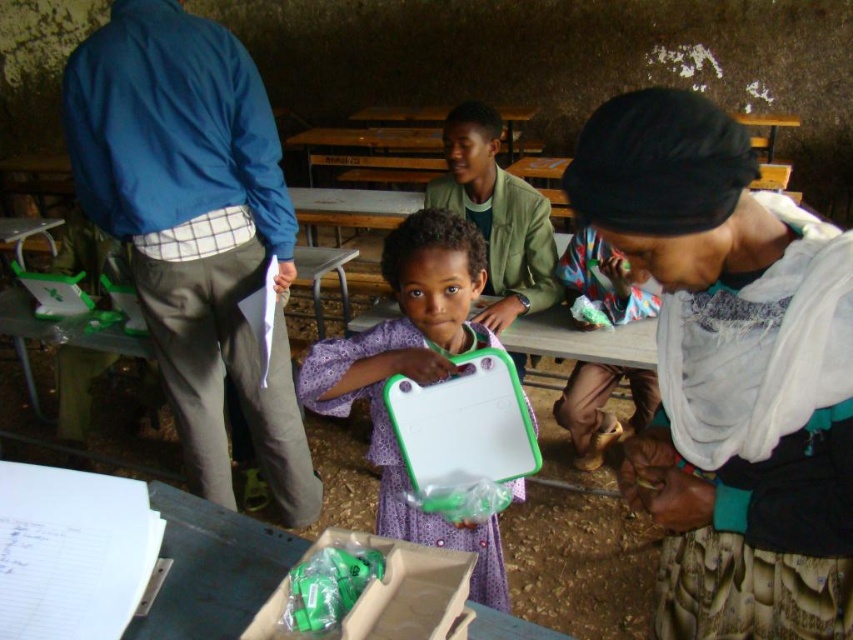
Is white cloth headscarf at upper right positioned behind purple fabric dress at center?

No, it is in front of purple fabric dress at center.

Does white cloth headscarf at upper right have a lesser height compared to purple fabric dress at center?

Correct, white cloth headscarf at upper right is not as tall as purple fabric dress at center.

Who is more distant from viewer, (717, 282) or (433, 310)?

The point (433, 310) is behind.

In order to click on white cloth headscarf at upper right in this screenshot , I will do `click(730, 371)`.

In the scene shown: Between blue fabric jacket at upper left and green plastic tray at center, which one appears on the left side from the viewer's perspective?

blue fabric jacket at upper left is more to the left.

Is point (270, 237) positioned in front of point (258, 598)?

That is False.

Locate an element on the screen. This screenshot has width=853, height=640. blue fabric jacket at upper left is located at coordinates (194, 227).

At what (x,y) coordinates should I click in order to perform the action: click on green plastic tray at center. Please return your answer as a coordinate pair (x, y). Looking at the image, I should click on (212, 570).

From the picture: Is green plastic tray at center to the right of multicolored fabric at lower right from the viewer's perspective?

In fact, green plastic tray at center is to the left of multicolored fabric at lower right.

Does point (212, 605) come farther from viewer compared to point (563, 397)?

That is False.

Where is `green plastic tray at center`? Image resolution: width=853 pixels, height=640 pixels. green plastic tray at center is located at coordinates (212, 570).